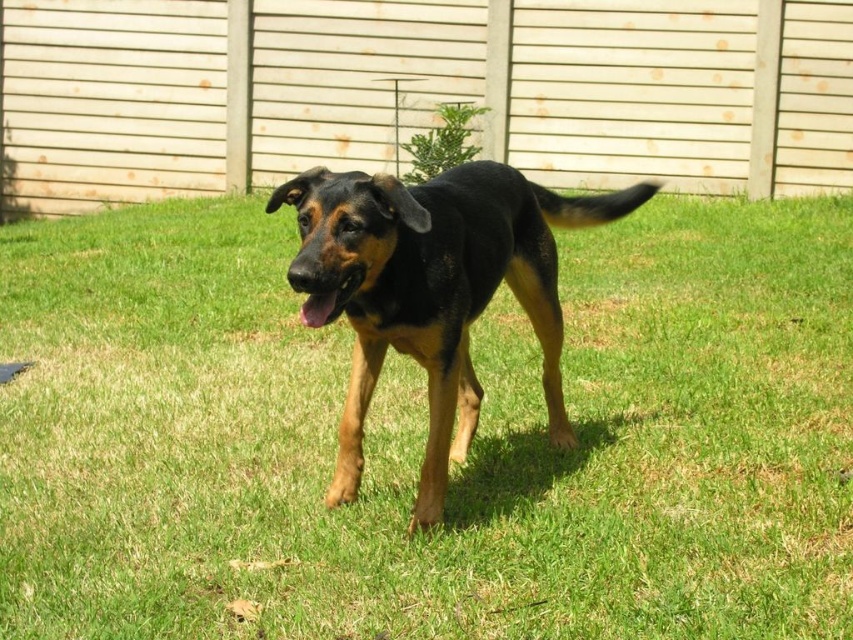
Question: Can you confirm if green grass at center is positioned to the left of black smooth dog at center?

Choices:
 (A) no
 (B) yes

Answer: (A)

Question: Which of the following is the farthest from the observer?

Choices:
 (A) (18, 520)
 (B) (506, 221)

Answer: (B)

Question: Can you confirm if green grass at center is positioned below black smooth dog at center?

Choices:
 (A) no
 (B) yes

Answer: (B)

Question: Among these points, which one is nearest to the camera?

Choices:
 (A) (331, 227)
 (B) (688, 506)

Answer: (A)

Question: Does green grass at center appear on the left side of black smooth dog at center?

Choices:
 (A) no
 (B) yes

Answer: (A)